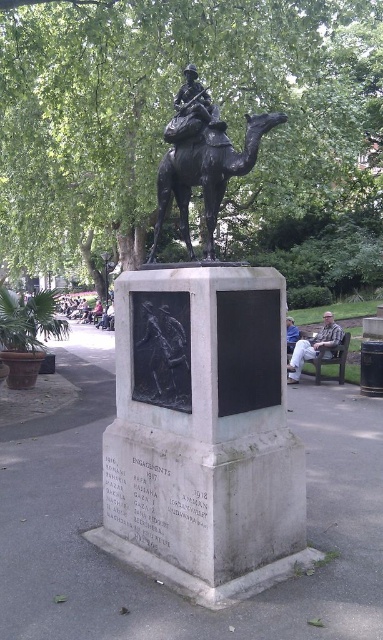
Question: Can you confirm if bronze statue at center is positioned below metallic helmet at center?

Choices:
 (A) no
 (B) yes

Answer: (B)

Question: Among these objects, which one is nearest to the camera?

Choices:
 (A) camouflage-patterned shirt at lower right
 (B) bronze statue of camel at center

Answer: (B)

Question: Does green leafy tree at upper center appear on the left side of bronze statue at center?

Choices:
 (A) no
 (B) yes

Answer: (A)

Question: Which object is the closest to the bronze statue at center?

Choices:
 (A) camouflage-patterned shirt at lower right
 (B) black matte relief at center
 (C) bronze statue of camel at center

Answer: (B)

Question: Which object is closer to the camera taking this photo?

Choices:
 (A) bronze statue of camel at center
 (B) green leafy tree at upper center
 (C) metallic helmet at center

Answer: (A)

Question: Is the position of camouflage-patterned shirt at lower right more distant than that of metallic helmet at center?

Choices:
 (A) yes
 (B) no

Answer: (B)